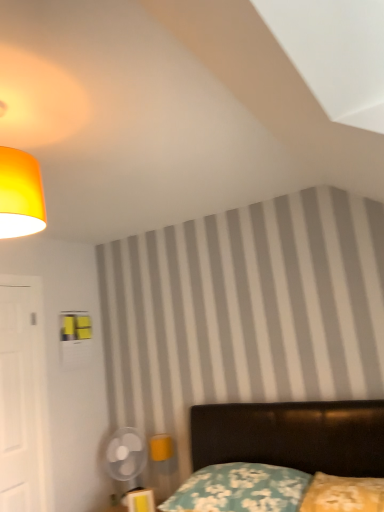
You are a GUI agent. You are given a task and a screenshot of the screen. Output one action in this format:
    pyautogui.click(x=<x>, y=<y>)
    Task: Click on the floral fabric pillow at lower center, which ranks as the 1th pillow in left-to-right order
    This screenshot has width=384, height=512.
    Given the screenshot: What is the action you would take?
    pyautogui.click(x=240, y=489)

Where is `velvet black bed at lower right`? velvet black bed at lower right is located at coordinates (283, 443).

The height and width of the screenshot is (512, 384). What do you see at coordinates (126, 456) in the screenshot? I see `transparent plastic fan at lower left` at bounding box center [126, 456].

Where is `yellow fabric pillow at lower right, which is the first pillow in right-to-left order`? This screenshot has height=512, width=384. yellow fabric pillow at lower right, which is the first pillow in right-to-left order is located at coordinates (343, 494).

Measure the distance between point (17, 304) and camera.

Point (17, 304) and camera are 9.12 feet apart.

Where is `floral fabric pillow at lower center, which ranks as the 1th pillow in left-to-right order`? This screenshot has width=384, height=512. floral fabric pillow at lower center, which ranks as the 1th pillow in left-to-right order is located at coordinates (240, 489).

In the scene shown: Which object is further away from the camera, yellow fabric pillow at lower right, the second pillow in the left-to-right sequence, or transparent plastic fan at lower left?

transparent plastic fan at lower left is further from the camera.

From the image's perspective, between yellow fabric pillow at lower right, which is the first pillow in right-to-left order, and transparent plastic fan at lower left, which one is located above?

yellow fabric pillow at lower right, which is the first pillow in right-to-left order, from the image's perspective.

Considering the relative sizes of yellow fabric pillow at lower right, which is the first pillow in right-to-left order, and transparent plastic fan at lower left in the image provided, is yellow fabric pillow at lower right, which is the first pillow in right-to-left order, thinner than transparent plastic fan at lower left?

Incorrect, the width of yellow fabric pillow at lower right, which is the first pillow in right-to-left order, is not less than that of transparent plastic fan at lower left.

Measure the distance between yellow fabric pillow at lower right, the second pillow in the left-to-right sequence, and transparent plastic fan at lower left.

yellow fabric pillow at lower right, the second pillow in the left-to-right sequence, and transparent plastic fan at lower left are 1.40 meters apart from each other.

Where is `door that appears in front of the transparent plastic fan at lower left`? door that appears in front of the transparent plastic fan at lower left is located at coordinates (23, 398).

From the image's perspective, between transparent plastic fan at lower left and white matte door at left, who is located below?

transparent plastic fan at lower left.

In the scene shown: Is transparent plastic fan at lower left to the right of white matte door at left from the viewer's perspective?

Indeed, transparent plastic fan at lower left is positioned on the right side of white matte door at left.

From the picture: How different are the orientations of transparent plastic fan at lower left and white matte door at left in degrees?

They differ by 89.2 degrees in their facing directions.

From the image's perspective, is matte yellow lampshade at upper left above yellow fabric pillow at lower right, the second pillow in the left-to-right sequence?

Correct, matte yellow lampshade at upper left appears higher than yellow fabric pillow at lower right, the second pillow in the left-to-right sequence, in the image.

From a real-world perspective, relative to yellow fabric pillow at lower right, which is the first pillow in right-to-left order, is matte yellow lampshade at upper left vertically above or below?

In terms of real-world spatial position, matte yellow lampshade at upper left is above yellow fabric pillow at lower right, which is the first pillow in right-to-left order.

Considering the relative sizes of matte yellow lampshade at upper left and yellow fabric pillow at lower right, the second pillow in the left-to-right sequence, in the image provided, is matte yellow lampshade at upper left wider than yellow fabric pillow at lower right, the second pillow in the left-to-right sequence,?

In fact, matte yellow lampshade at upper left might be narrower than yellow fabric pillow at lower right, the second pillow in the left-to-right sequence.

Is point (38, 101) in front of point (349, 486)?

Yes, point (38, 101) is in front of point (349, 486).

Which pillow is the 1st one when counting from the right side of the velvet black bed at lower right? Please provide its 2D coordinates.

[(240, 489)]

From a real-world perspective, is velvet black bed at lower right physically located above or below floral fabric pillow at lower center, which ranks as the 2th pillow in right-to-left order?

Clearly, from a real-world perspective, velvet black bed at lower right is above floral fabric pillow at lower center, which ranks as the 2th pillow in right-to-left order.

Does point (232, 434) come in front of point (281, 474)?

That is False.

Could you measure the distance between velvet black bed at lower right and floral fabric pillow at lower center, which ranks as the 2th pillow in right-to-left order?

A distance of 4.32 inches exists between velvet black bed at lower right and floral fabric pillow at lower center, which ranks as the 2th pillow in right-to-left order.

Does yellow fabric pillow at lower right, which is the first pillow in right-to-left order, have a smaller size compared to floral fabric pillow at lower center, which ranks as the 1th pillow in left-to-right order?

Yes.

From a real-world perspective, which object stands above the other?

From a 3D spatial view, yellow fabric pillow at lower right, the second pillow in the left-to-right sequence, is above.

Would you say yellow fabric pillow at lower right, which is the first pillow in right-to-left order, is to the left or to the right of floral fabric pillow at lower center, which ranks as the 1th pillow in left-to-right order, in the picture?

yellow fabric pillow at lower right, which is the first pillow in right-to-left order, is positioned on floral fabric pillow at lower center, which ranks as the 1th pillow in left-to-right order,'s right side.

Considering the relative sizes of matte yellow lampshade at upper left and white matte door at left in the image provided, is matte yellow lampshade at upper left shorter than white matte door at left?

Correct, matte yellow lampshade at upper left is not as tall as white matte door at left.

From the picture: From the image's perspective, which is above, matte yellow lampshade at upper left or white matte door at left?

matte yellow lampshade at upper left.

Is point (33, 211) closer to camera compared to point (5, 347)?

Yes, point (33, 211) is closer to viewer.

Is transparent plastic fan at lower left not inside velvet black bed at lower right?

Yes.

Could you tell me if transparent plastic fan at lower left is turned towards velvet black bed at lower right?

No, transparent plastic fan at lower left is not oriented towards velvet black bed at lower right.

Does transparent plastic fan at lower left have a lesser width compared to velvet black bed at lower right?

Yes.

From a real-world perspective, between transparent plastic fan at lower left and velvet black bed at lower right, who is vertically lower?

In real-world perspective, transparent plastic fan at lower left is lower.

There is a transparent plastic fan at lower left. Where is `the 2nd pillow above it (from the image's perspective)`? This screenshot has height=512, width=384. the 2nd pillow above it (from the image's perspective) is located at coordinates (343, 494).

You are a GUI agent. You are given a task and a screenshot of the screen. Output one action in this format:
    pyautogui.click(x=<x>, y=<y>)
    Task: Click on the door in front of the transparent plastic fan at lower left
    
    Given the screenshot: What is the action you would take?
    pyautogui.click(x=23, y=398)

Estimate the real-world distances between objects in this image. Which object is further from white matte door at left, matte yellow lampshade at upper left or velvet black bed at lower right?

The object further to white matte door at left is matte yellow lampshade at upper left.

Based on their spatial positions, is velvet black bed at lower right or floral fabric pillow at lower center, which ranks as the 1th pillow in left-to-right order, closer to yellow fabric pillow at lower right, which is the first pillow in right-to-left order?

Based on the image, floral fabric pillow at lower center, which ranks as the 1th pillow in left-to-right order, appears to be nearer to yellow fabric pillow at lower right, which is the first pillow in right-to-left order.

From the picture: Estimate the real-world distances between objects in this image. Which object is further from velvet black bed at lower right, yellow fabric pillow at lower right, which is the first pillow in right-to-left order, or matte yellow lampshade at upper left?

matte yellow lampshade at upper left.

Estimate the real-world distances between objects in this image. Which object is further from matte yellow lampshade at upper left, floral fabric pillow at lower center, which ranks as the 2th pillow in right-to-left order, or velvet black bed at lower right?

Among the two, velvet black bed at lower right is located further to matte yellow lampshade at upper left.

From the picture: Which object lies nearer to the anchor point matte yellow lampshade at upper left, white matte door at left or floral fabric pillow at lower center, which ranks as the 1th pillow in left-to-right order?

white matte door at left lies closer to matte yellow lampshade at upper left than the other object.

Looking at this image, looking at the image, which one is located further to floral fabric pillow at lower center, which ranks as the 2th pillow in right-to-left order, white matte door at left or velvet black bed at lower right?

white matte door at left is positioned further to the anchor floral fabric pillow at lower center, which ranks as the 2th pillow in right-to-left order.

Looking at the image, which one is located closer to velvet black bed at lower right, yellow fabric pillow at lower right, which is the first pillow in right-to-left order, or white matte door at left?

yellow fabric pillow at lower right, which is the first pillow in right-to-left order, lies closer to velvet black bed at lower right than the other object.

Estimate the real-world distances between objects in this image. Which object is further from white matte door at left, yellow fabric pillow at lower right, the second pillow in the left-to-right sequence, or velvet black bed at lower right?

yellow fabric pillow at lower right, the second pillow in the left-to-right sequence, lies further to white matte door at left than the other object.

Image resolution: width=384 pixels, height=512 pixels. Find the location of `door between matte yellow lampshade at upper left and floral fabric pillow at lower center, which ranks as the 1th pillow in left-to-right order, vertically`. door between matte yellow lampshade at upper left and floral fabric pillow at lower center, which ranks as the 1th pillow in left-to-right order, vertically is located at coordinates (23, 398).

Find the location of a particular element. bed located between white matte door at left and yellow fabric pillow at lower right, the second pillow in the left-to-right sequence, in the left-right direction is located at coordinates (283, 443).

At what (x,y) coordinates should I click in order to perform the action: click on mechanical fan between white matte door at left and floral fabric pillow at lower center, which ranks as the 1th pillow in left-to-right order. Please return your answer as a coordinate pair (x, y). Looking at the image, I should click on (126, 456).

Find the location of a particular element. The image size is (384, 512). pillow located between white matte door at left and yellow fabric pillow at lower right, the second pillow in the left-to-right sequence, in the left-right direction is located at coordinates (240, 489).